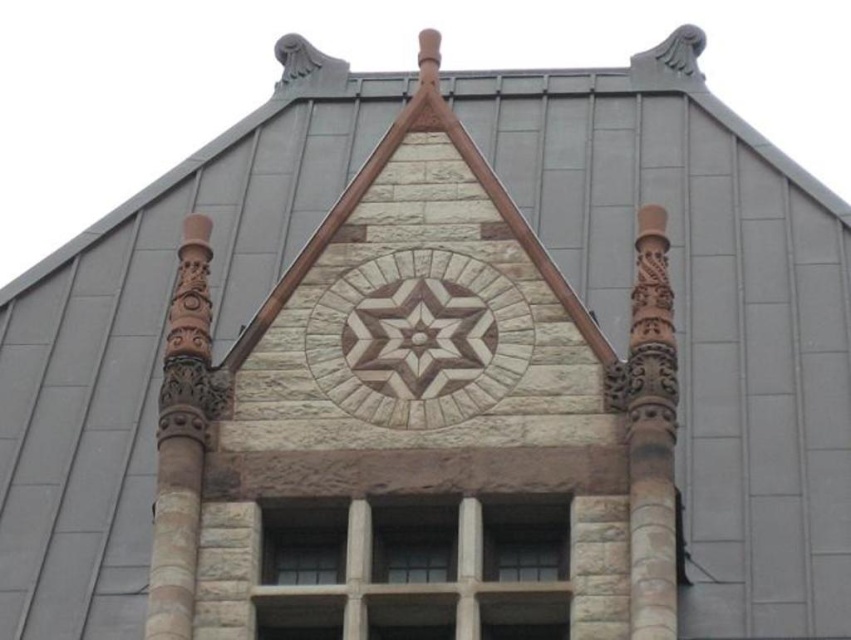
Question: Can you confirm if brown stone star at center is bigger than brown carved wood pillar at right?

Choices:
 (A) no
 (B) yes

Answer: (A)

Question: Considering the real-world distances, which object is farthest from the brown carved pillar at left?

Choices:
 (A) brown carved wood pillar at right
 (B) brown stone star at center

Answer: (A)

Question: Which point is farther from the camera taking this photo?

Choices:
 (A) (157, 595)
 (B) (641, 205)

Answer: (B)

Question: Can you confirm if brown carved wood pillar at right is bigger than brown carved pillar at left?

Choices:
 (A) yes
 (B) no

Answer: (B)

Question: Is brown carved wood pillar at right wider than brown carved pillar at left?

Choices:
 (A) no
 (B) yes

Answer: (A)

Question: Among these objects, which one is farthest from the camera?

Choices:
 (A) brown carved wood pillar at right
 (B) brown stone star at center

Answer: (B)